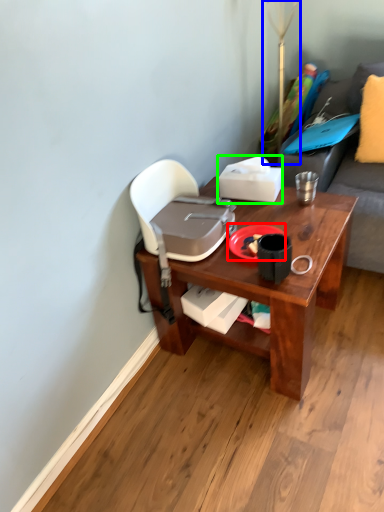
Question: Which object is the farthest from plate (highlighted by a red box)? Choose among these: table lamp (highlighted by a blue box) or box (highlighted by a green box).

Choices:
 (A) table lamp
 (B) box

Answer: (A)